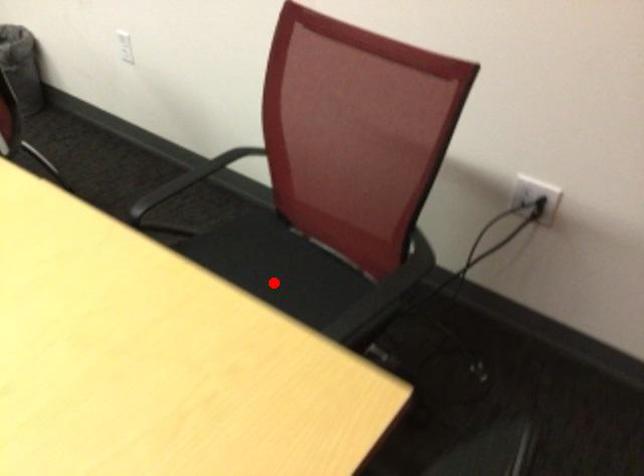
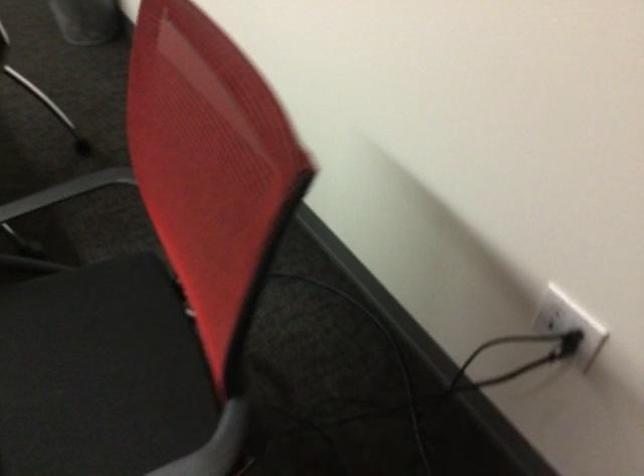
Where in the second image is the point corresponding to the highlighted location from the first image?

(93, 372)